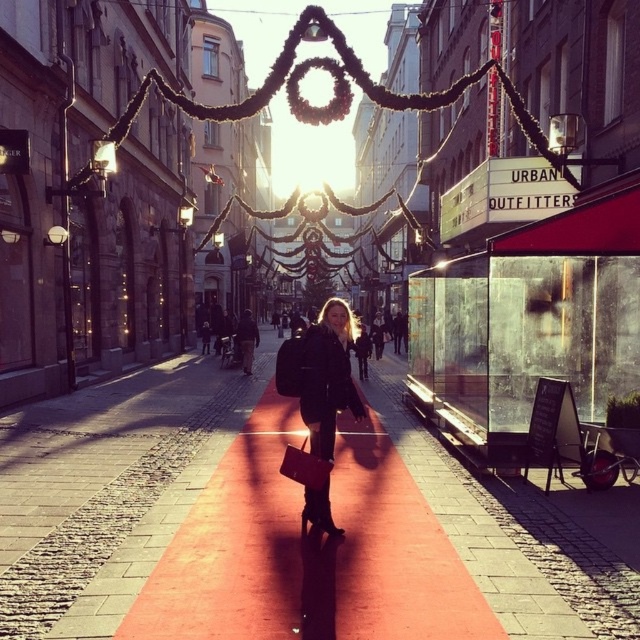
You are a delivery person who needs to place a small package on the smooth red carpet at center. However, there is a matte black coat at center in the way. Can you place the package directly on the carpet without moving the coat?

The smooth red carpet at center is located below the matte black coat at center, so you can place the package directly on the carpet without moving the coat because the coat is above it.

You are standing on the cobblestone pavement in the middle of the street and see the point marked as point (326, 376). What object is located at that point?

The point (326, 376) corresponds to the location of the matte black coat at center.